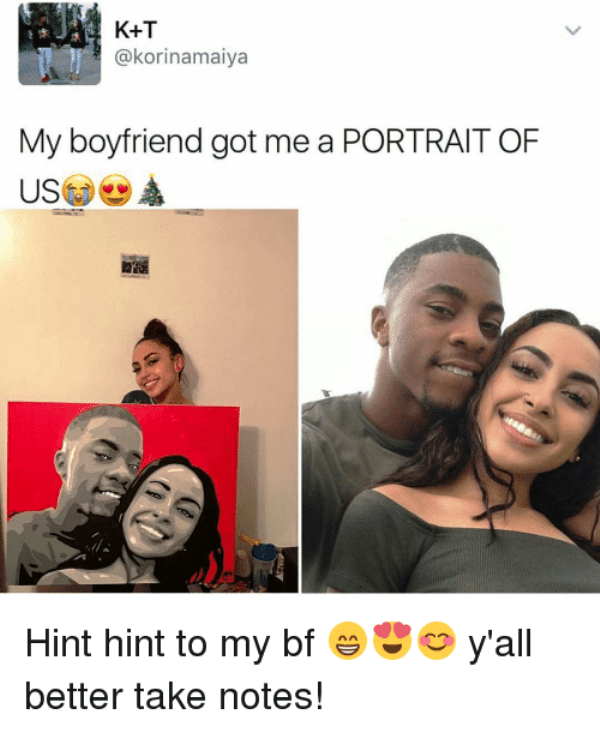
The width and height of the screenshot is (600, 732). Find the location of `wall`. wall is located at coordinates (246, 307).